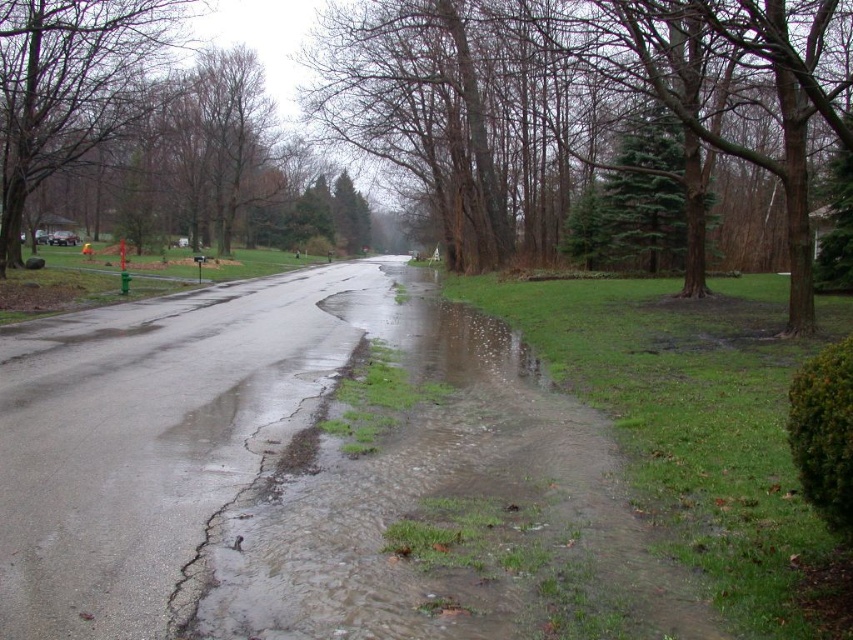
Question: Considering the real-world distances, which object is farthest from the clear water at lower center?

Choices:
 (A) green textured tree at center
 (B) green leafy tree at upper left

Answer: (A)

Question: Is green textured tree at center to the left of green leafy tree at upper left from the viewer's perspective?

Choices:
 (A) yes
 (B) no

Answer: (B)

Question: Can you confirm if clear water at lower center is thinner than green textured tree at center?

Choices:
 (A) no
 (B) yes

Answer: (B)

Question: In this image, where is clear water at lower center located relative to green textured tree at center?

Choices:
 (A) above
 (B) below

Answer: (B)

Question: Which point is farther to the camera?

Choices:
 (A) (466, 220)
 (B) (491, 432)
 (C) (3, 74)

Answer: (A)

Question: Estimate the real-world distances between objects in this image. Which object is farther from the clear water at lower center?

Choices:
 (A) green leafy tree at upper left
 (B) green textured tree at center

Answer: (B)